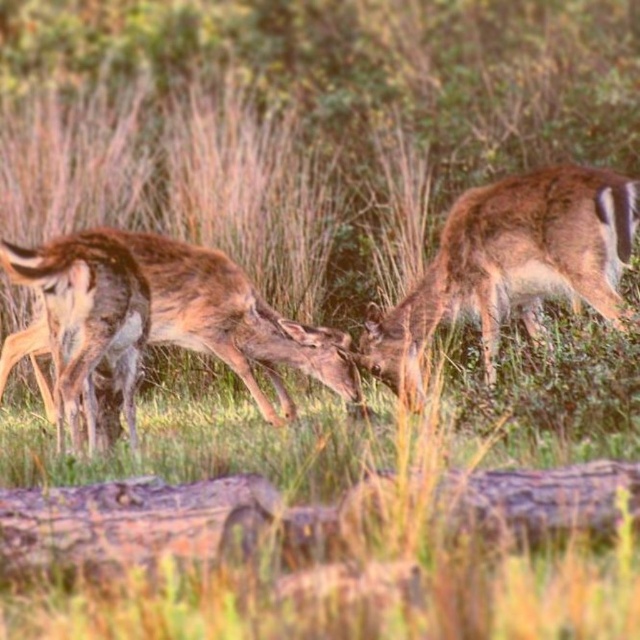
Question: Is wooden log at lower center to the left of brown fur coat at left from the viewer's perspective?

Choices:
 (A) no
 (B) yes

Answer: (A)

Question: Does brown furry deer at right lie behind brown fur coat at left?

Choices:
 (A) no
 (B) yes

Answer: (B)

Question: Which point is closer to the camera?

Choices:
 (A) wooden log at lower center
 (B) brown fur coat at left

Answer: (A)

Question: Which point is farther from the camera taking this photo?

Choices:
 (A) (484, 237)
 (B) (476, 493)

Answer: (A)

Question: Which point is farther to the camera?

Choices:
 (A) brown fur deer at center
 (B) wooden log at lower center

Answer: (A)

Question: Can you confirm if wooden log at lower center is smaller than brown fur deer at center?

Choices:
 (A) yes
 (B) no

Answer: (A)